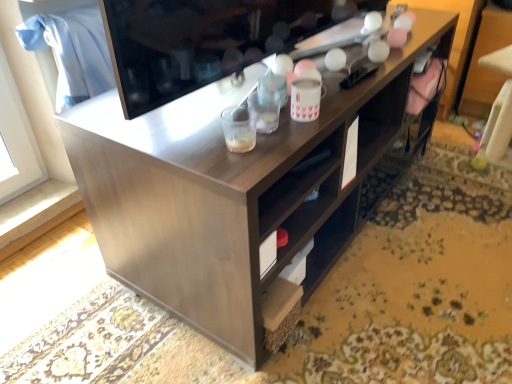
The width and height of the screenshot is (512, 384). In order to click on free space behind translucent plastic cup at center, arranged as the 1th beverage when viewed from the left in this screenshot , I will do `click(221, 110)`.